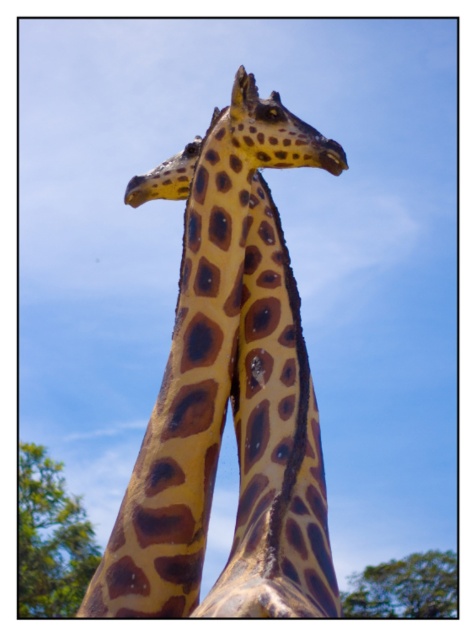
You are a GUI agent. You are given a task and a screenshot of the screen. Output one action in this format:
    pyautogui.click(x=<x>, y=<y>)
    Task: Click on the green leafy tree at lower left
    This screenshot has width=476, height=640.
    Given the screenshot: What is the action you would take?
    pyautogui.click(x=50, y=538)

Between green leafy tree at lower left and green leafy tree at lower right, which one appears on the right side from the viewer's perspective?

Positioned to the right is green leafy tree at lower right.

The width and height of the screenshot is (476, 640). In order to click on green leafy tree at lower left in this screenshot , I will do [50, 538].

Which is below, spotted fur giraffe at center or green leafy tree at lower right?

green leafy tree at lower right is lower down.

The image size is (476, 640). Identify the location of spotted fur giraffe at center. (230, 397).

Which is in front, point (246, 385) or point (267, 106)?

Point (246, 385)

Which of these two, spotted fur giraffe at center or spotted fur giraffe head at center, stands shorter?

With less height is spotted fur giraffe head at center.

Measure the distance between point (315, 525) and camera.

44.38 meters

What are the coordinates of `spotted fur giraffe at center` in the screenshot? It's located at (230, 397).